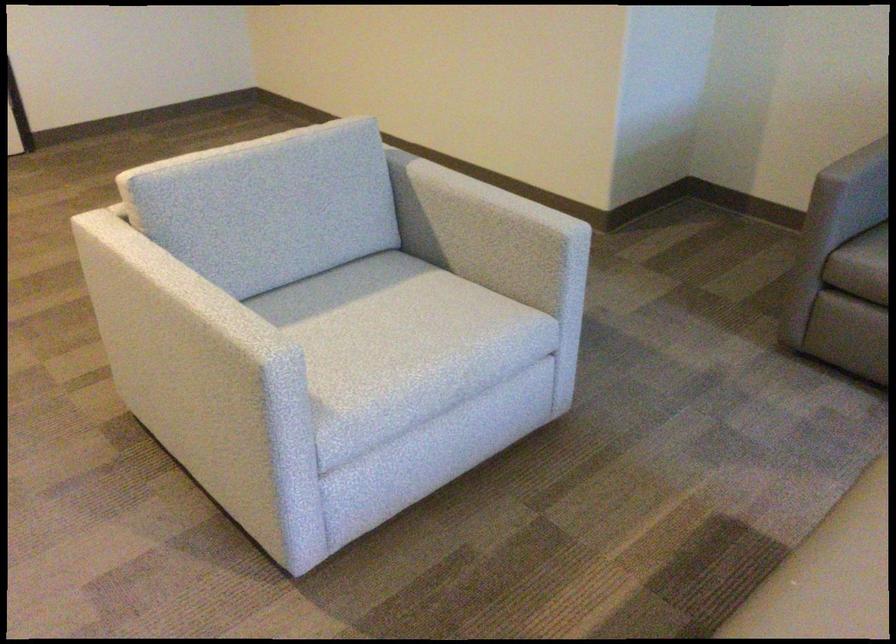
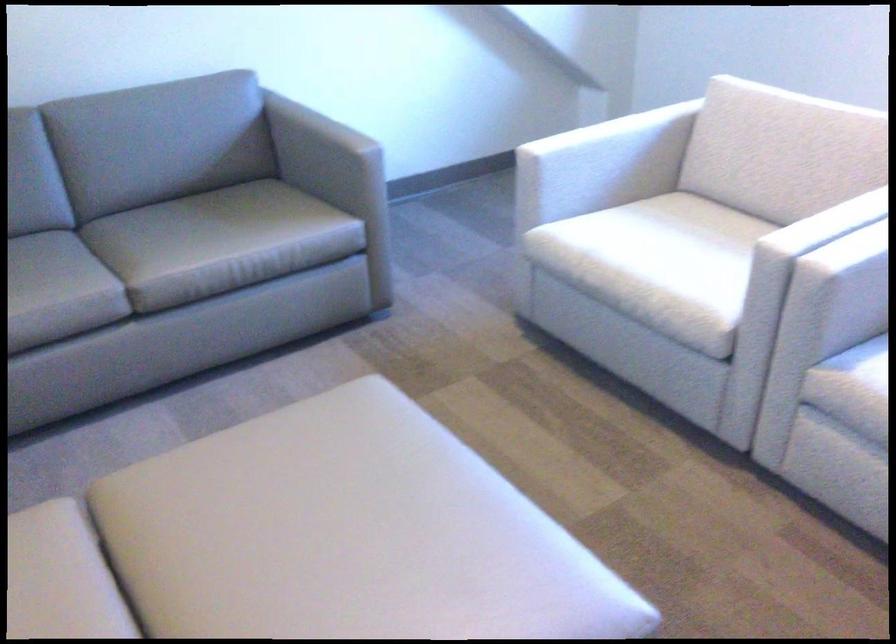
How did the camera likely rotate?

The camera's rotation is toward right-down.